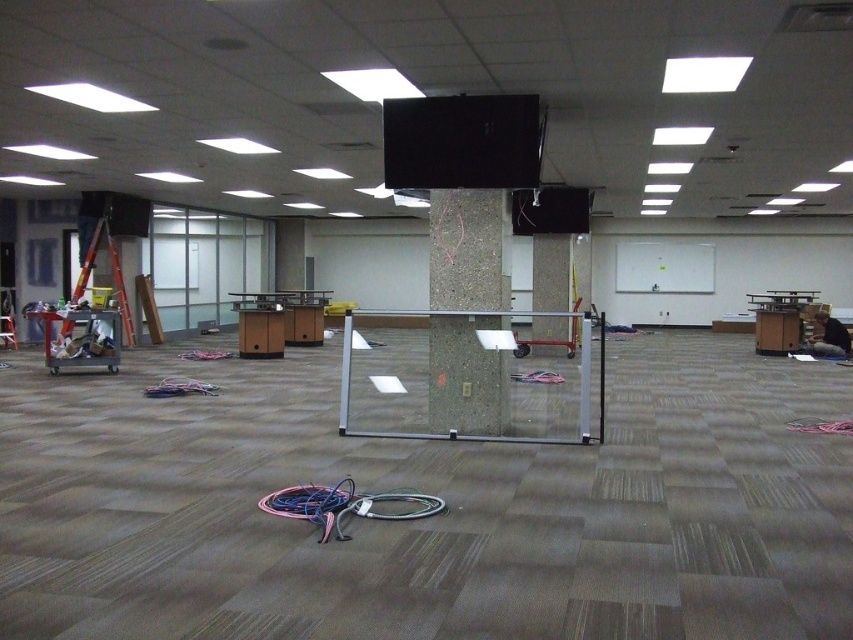
Question: Can you confirm if concrete at center is positioned below textured concrete pillar at center?

Choices:
 (A) yes
 (B) no

Answer: (A)

Question: Among these points, which one is nearest to the camera?

Choices:
 (A) (554, 276)
 (B) (495, 372)

Answer: (B)

Question: Can you confirm if concrete at center is smaller than textured concrete pillar at center?

Choices:
 (A) no
 (B) yes

Answer: (B)

Question: Does concrete at center have a larger size compared to textured concrete pillar at center?

Choices:
 (A) no
 (B) yes

Answer: (A)

Question: Which of the following is the farthest from the observer?

Choices:
 (A) (463, 224)
 (B) (554, 237)

Answer: (B)